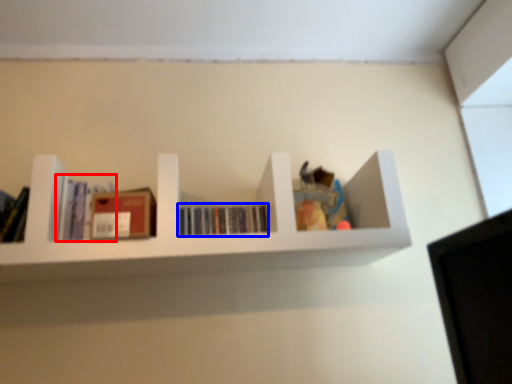
Question: Which point is further to the camera, book (highlighted by a red box) or book (highlighted by a blue box)?

Choices:
 (A) book
 (B) book

Answer: (B)